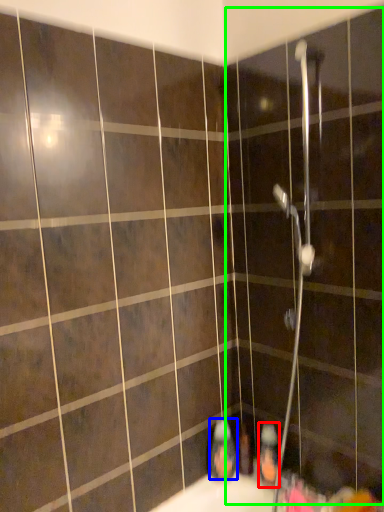
Question: Which object is the farthest from toiletry (highlighted by a red box)? Choose among these: toiletry (highlighted by a blue box) or screen door (highlighted by a green box).

Choices:
 (A) toiletry
 (B) screen door

Answer: (B)